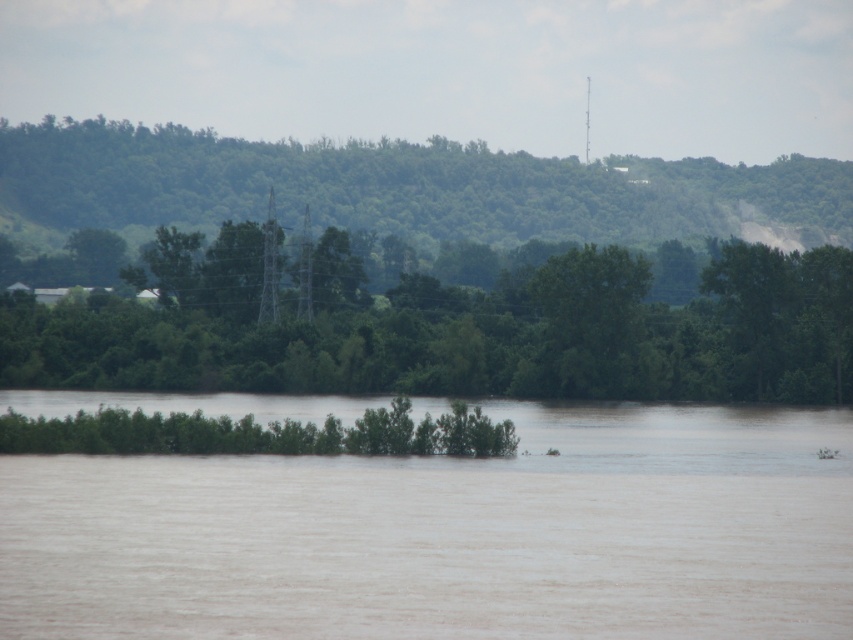
Question: Can you confirm if brown muddy water at center is positioned below green leafy tree at center?

Choices:
 (A) no
 (B) yes

Answer: (B)

Question: Is brown muddy water at center thinner than green leafy tree at center?

Choices:
 (A) no
 (B) yes

Answer: (B)

Question: Is brown muddy water at center to the right of green leafy tree at center from the viewer's perspective?

Choices:
 (A) no
 (B) yes

Answer: (A)

Question: Among these objects, which one is farthest from the camera?

Choices:
 (A) brown muddy water at center
 (B) green leafy tree at center

Answer: (B)